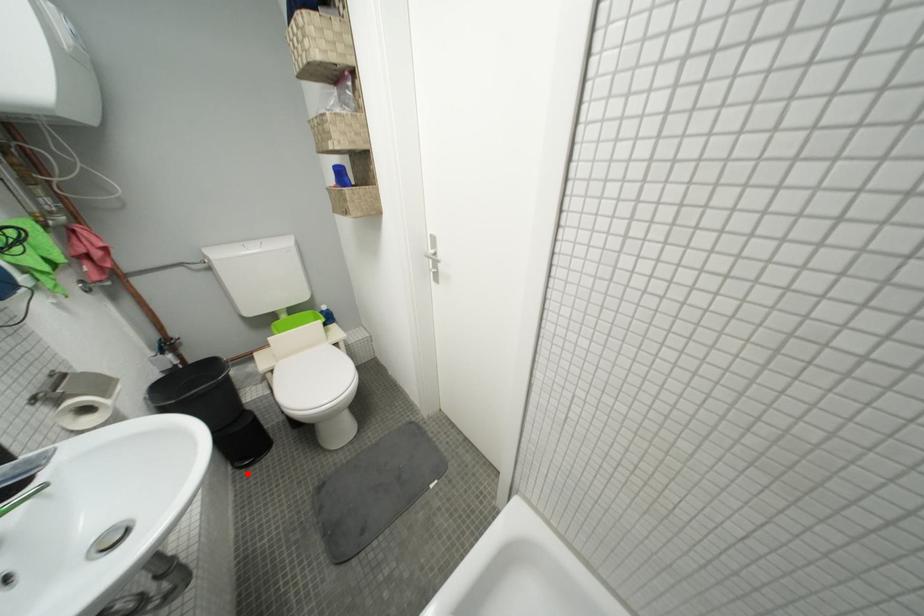
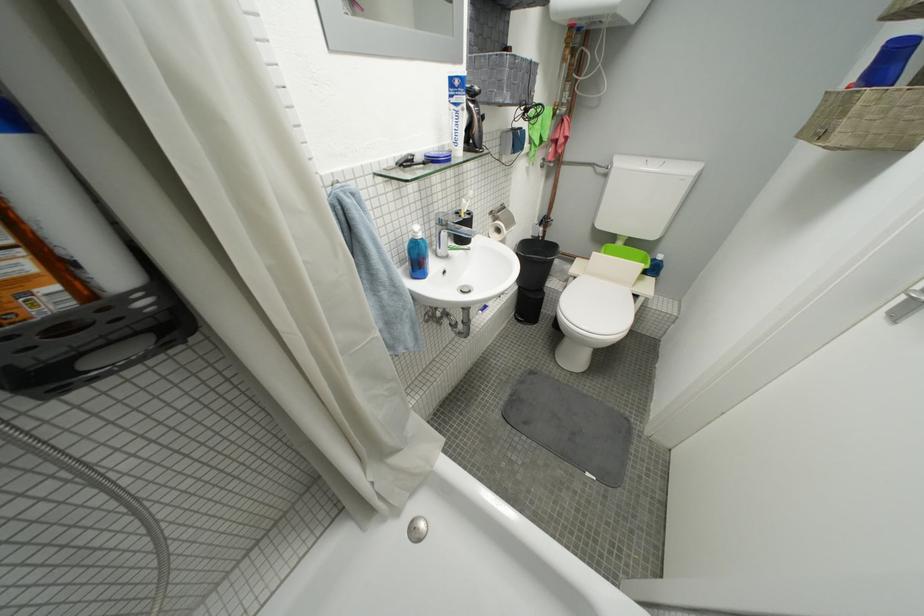
Find the pixel in the second image that matches the highlighted location in the first image.

(523, 322)